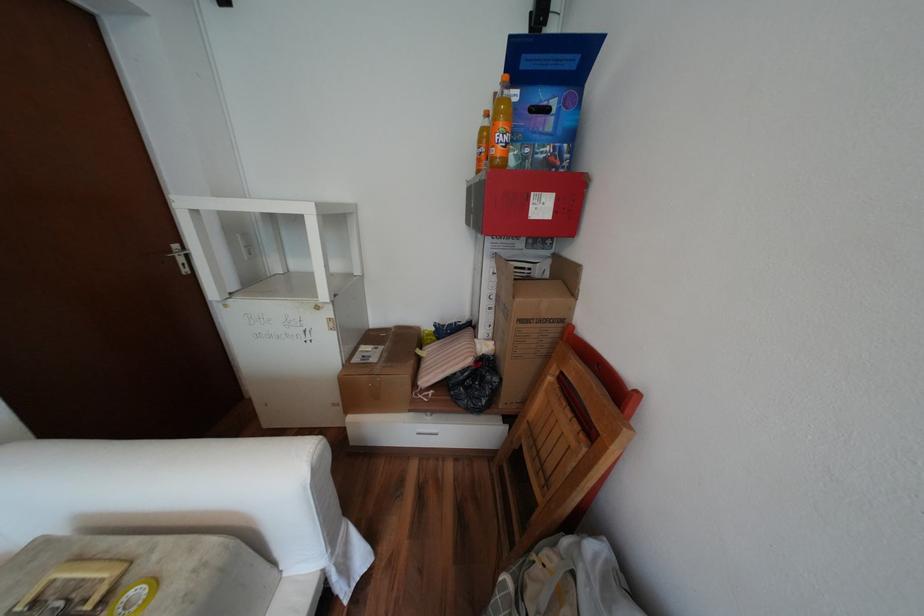
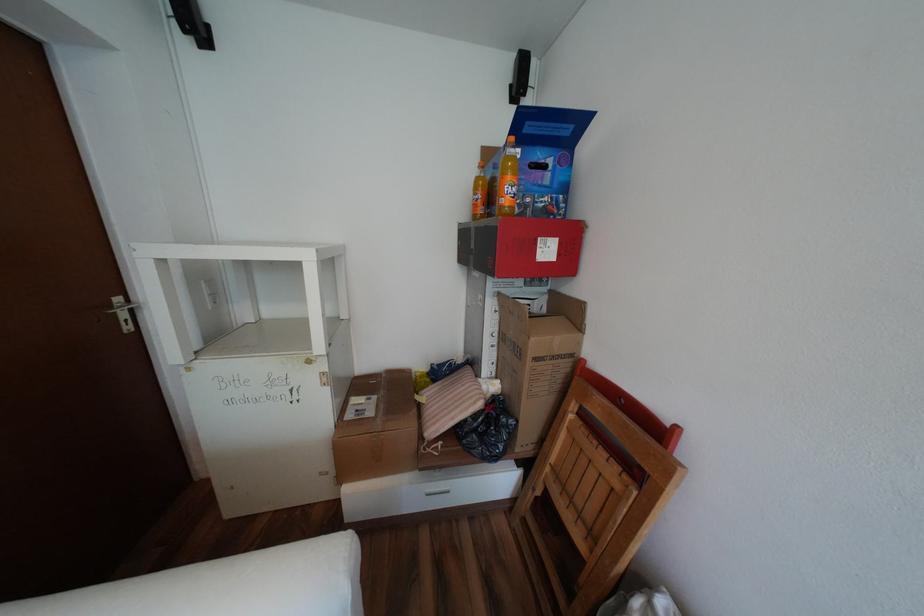
In the second image, find the point that corresponds to point (185, 246) in the first image.

(128, 299)